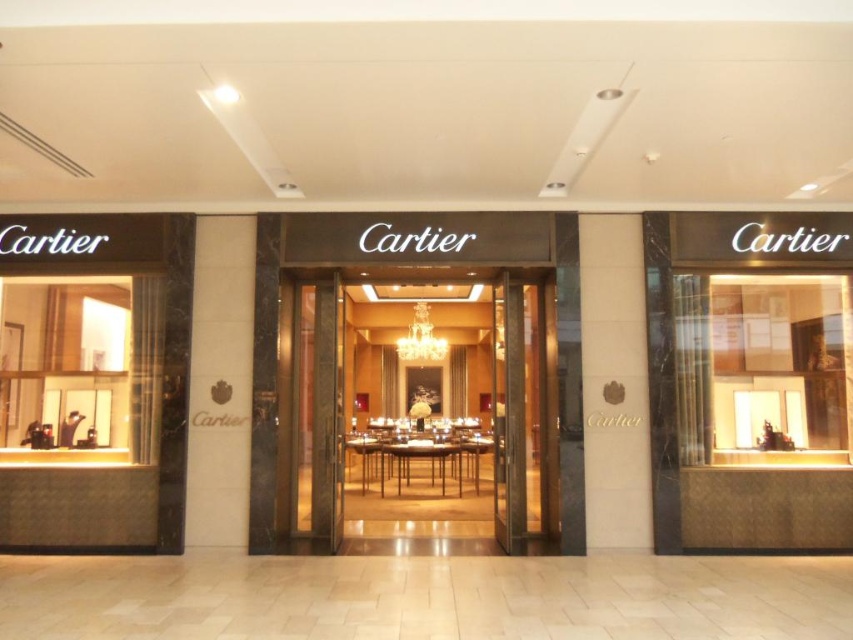
You are a customer entering the Cartier store. You notice the gold polished wood entrance at center and the transparent glass door at center. Which entrance feature is taller?

The gold polished wood entrance at center is taller than the transparent glass door at center.

You are a delivery person carrying a large package that is 1.2 meters wide. You arrive at the Cartier store entrance and see the gold polished wood entrance at center and the transparent glass door at center. Can your package fit through the entrance without being damaged?

The gold polished wood entrance at center might be wider than transparent glass door at center. Since the package is 1.2 meters wide, it is possible that the gold polished wood entrance at center is wide enough to accommodate it. However, without exact measurements, it is uncertain. You should check the width of the gold polished wood entrance at center before attempting to pass through.

From the picture: You are a delivery person carrying a large package that is 7 feet long. You need to enter the Cartier store through the entrance. The entrance has both the gold polished wood entrance at center and the transparent glass door at center. Can you fit through the entrance without tilting the package?

The gold polished wood entrance at center and transparent glass door at center are 7.22 feet apart from each other. Since the package is 7 feet long, it can fit through the entrance as the distance between the two is slightly wider than the package.